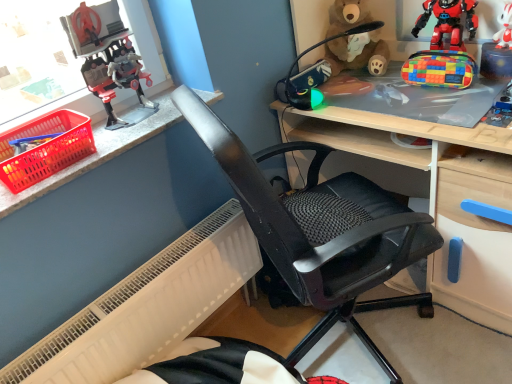
The image size is (512, 384). Identify the location of vacant space positioned to the left of multicolored plastic toy at upper right, placed as the fourth toy when sorted from left to right. (397, 92).